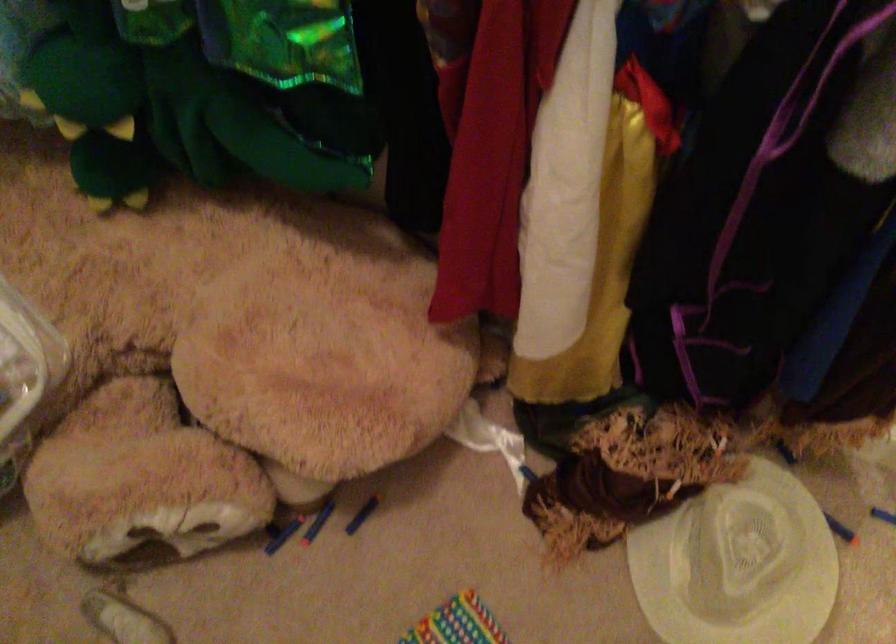
At what (x,y) coordinates should I click in order to perform the action: click on furry chair sitting surface. Please return your answer as a coordinate pair (x, y). The image size is (896, 644). Looking at the image, I should click on (247, 321).